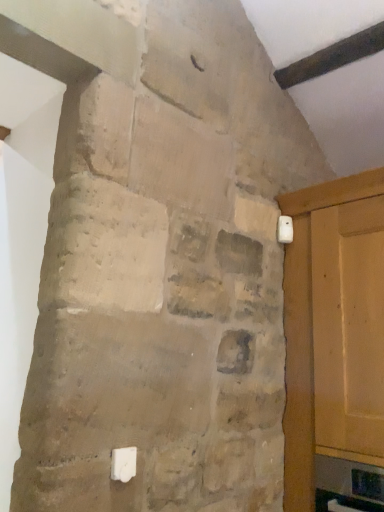
Question: From the image's perspective, is white plastic light switch at upper right, the 2th light switch positioned from the bottom, under white plastic light switch at lower center, the 2th light switch from the back?

Choices:
 (A) yes
 (B) no

Answer: (B)

Question: Considering the relative positions of white plastic light switch at upper right, positioned as the first light switch in right-to-left order, and white plastic light switch at lower center, the 2th light switch from the back, in the image provided, is white plastic light switch at upper right, positioned as the first light switch in right-to-left order, to the right of white plastic light switch at lower center, the 2th light switch from the back, from the viewer's perspective?

Choices:
 (A) yes
 (B) no

Answer: (A)

Question: Considering the relative sizes of white plastic light switch at upper right, which is the 1th light switch in back-to-front order, and white plastic light switch at lower center, the 1th light switch in the front-to-back sequence, in the image provided, is white plastic light switch at upper right, which is the 1th light switch in back-to-front order, smaller than white plastic light switch at lower center, the 1th light switch in the front-to-back sequence,?

Choices:
 (A) no
 (B) yes

Answer: (A)

Question: Is the position of white plastic light switch at upper right, the 2th light switch positioned from the bottom, more distant than that of white plastic light switch at lower center, the second light switch in the right-to-left sequence?

Choices:
 (A) yes
 (B) no

Answer: (A)

Question: Considering the relative sizes of white plastic light switch at upper right, which is the 1th light switch in back-to-front order, and white plastic light switch at lower center, the 2th light switch from the back, in the image provided, is white plastic light switch at upper right, which is the 1th light switch in back-to-front order, thinner than white plastic light switch at lower center, the 2th light switch from the back,?

Choices:
 (A) yes
 (B) no

Answer: (B)

Question: Is white plastic light switch at upper right, acting as the 2th light switch starting from the front, inside or outside of white plastic light switch at lower center, the second light switch in the right-to-left sequence?

Choices:
 (A) outside
 (B) inside

Answer: (A)

Question: Is white plastic light switch at upper right, the 1th light switch in the top-to-bottom sequence, bigger or smaller than white plastic light switch at lower center, the second light switch in the right-to-left sequence?

Choices:
 (A) big
 (B) small

Answer: (A)

Question: Considering their positions, is white plastic light switch at upper right, the 1th light switch in the top-to-bottom sequence, located in front of or behind white plastic light switch at lower center, the second light switch in the right-to-left sequence?

Choices:
 (A) front
 (B) behind

Answer: (B)

Question: Considering the positions of white plastic light switch at upper right, acting as the 2th light switch starting from the front, and white plastic light switch at lower center, arranged as the 1th light switch when viewed from the left, in the image, is white plastic light switch at upper right, acting as the 2th light switch starting from the front, taller or shorter than white plastic light switch at lower center, arranged as the 1th light switch when viewed from the left,?

Choices:
 (A) tall
 (B) short

Answer: (A)

Question: Is white plastic light switch at lower center, the second light switch in the right-to-left sequence, bigger or smaller than white plastic light switch at upper right, acting as the 2th light switch starting from the front?

Choices:
 (A) big
 (B) small

Answer: (B)

Question: Considering the positions of white plastic light switch at lower center, the 2th light switch from the back, and white plastic light switch at upper right, acting as the 2th light switch starting from the front, in the image, is white plastic light switch at lower center, the 2th light switch from the back, taller or shorter than white plastic light switch at upper right, acting as the 2th light switch starting from the front,?

Choices:
 (A) short
 (B) tall

Answer: (A)

Question: From a real-world perspective, is white plastic light switch at lower center, arranged as the 1th light switch when viewed from the left, positioned above or below white plastic light switch at upper right, the 2th light switch positioned from the bottom?

Choices:
 (A) above
 (B) below

Answer: (B)

Question: In the image, is white plastic light switch at lower center, the second light switch in the right-to-left sequence, positioned in front of or behind white plastic light switch at upper right, which is the 1th light switch in back-to-front order?

Choices:
 (A) behind
 (B) front

Answer: (B)

Question: Does point (355, 184) appear closer or farther from the camera than point (289, 238)?

Choices:
 (A) closer
 (B) farther

Answer: (A)

Question: Choose the correct answer: Is matte wood door at right inside white plastic light switch at upper right, the 2th light switch in the left-to-right sequence, or outside it?

Choices:
 (A) inside
 (B) outside

Answer: (B)